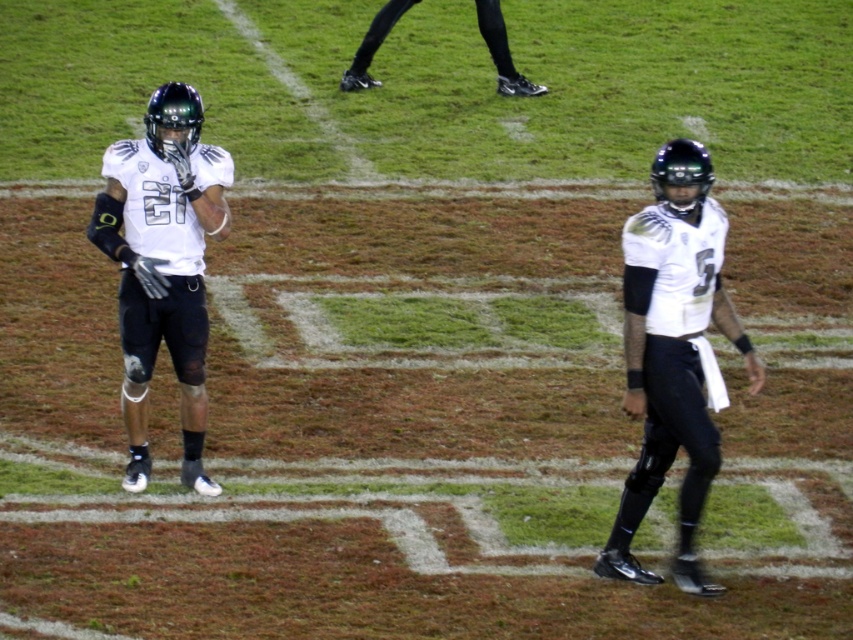
Between white matte jersey at center and black synthetic shoe at upper center, which one is positioned higher?

Positioned higher is black synthetic shoe at upper center.

The image size is (853, 640). What do you see at coordinates (672, 353) in the screenshot?
I see `white matte jersey at center` at bounding box center [672, 353].

Between point (671, 292) and point (370, 51), which one is positioned behind?

Point (370, 51)

Identify the location of white matte jersey at center. The image size is (853, 640). (672, 353).

Does white matte jersey at center have a greater width compared to matte black jersey at left?

Indeed, white matte jersey at center has a greater width compared to matte black jersey at left.

The width and height of the screenshot is (853, 640). Describe the element at coordinates (672, 353) in the screenshot. I see `white matte jersey at center` at that location.

In order to click on white matte jersey at center in this screenshot , I will do `click(672, 353)`.

Does point (141, 419) come farther from viewer compared to point (480, 10)?

That is False.

Describe the element at coordinates (163, 264) in the screenshot. I see `matte black jersey at left` at that location.

The image size is (853, 640). Identify the location of matte black jersey at left. (163, 264).